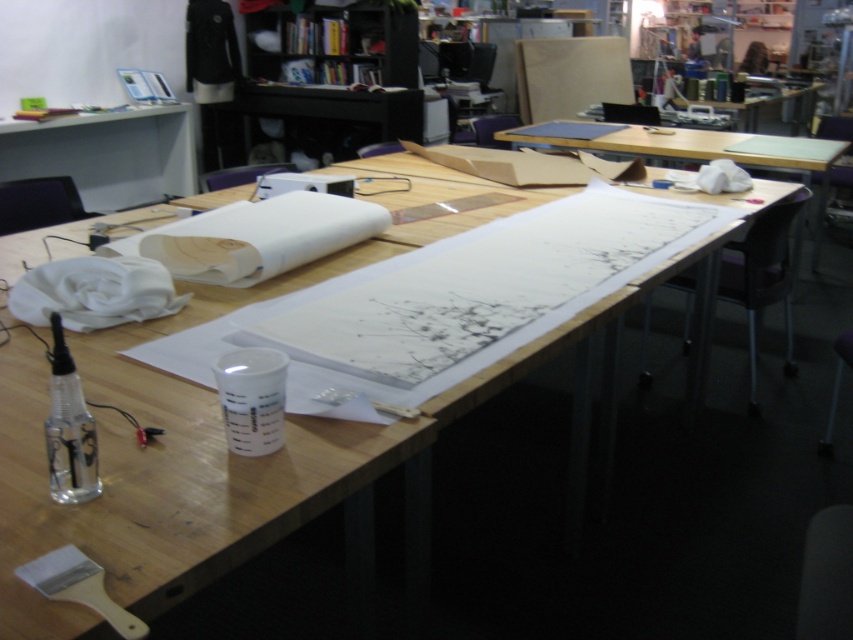
Question: Which of the following is the closest to the observer?

Choices:
 (A) wooden table at center
 (B) matte white desk at upper left

Answer: (A)

Question: Among these points, which one is nearest to the camera?

Choices:
 (A) (799, 156)
 (B) (109, 481)

Answer: (B)

Question: Does matte white desk at upper left appear over white paper at center?

Choices:
 (A) no
 (B) yes

Answer: (B)

Question: Does matte white desk at upper left appear over white paper at center?

Choices:
 (A) no
 (B) yes

Answer: (B)

Question: Which object is farther from the camera taking this photo?

Choices:
 (A) white paper at center
 (B) matte white desk at upper left

Answer: (B)

Question: Is wooden table at center wider than matte white desk at upper left?

Choices:
 (A) yes
 (B) no

Answer: (A)